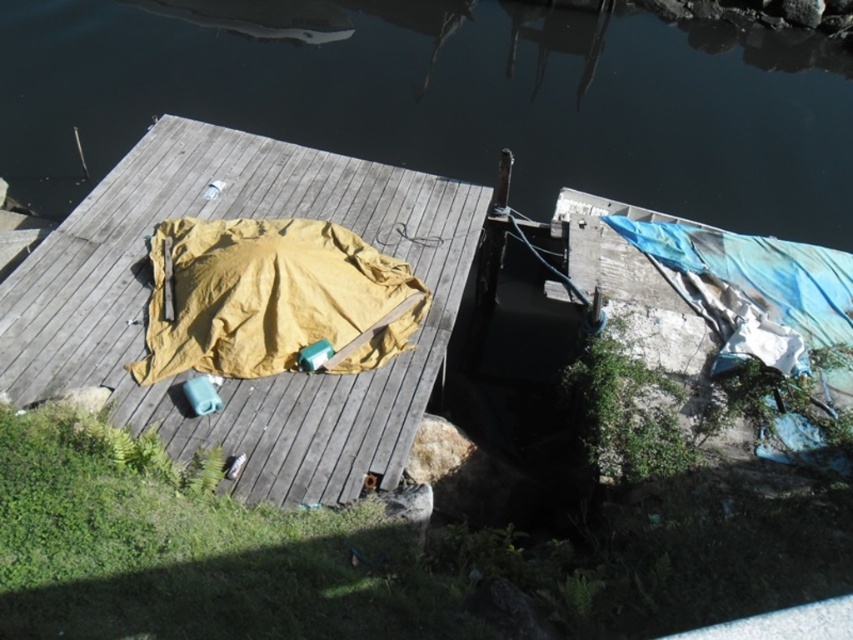
Can you confirm if transparent water at upper center is bigger than yellow fabric blanket at center?

Yes, transparent water at upper center is bigger than yellow fabric blanket at center.

Which is below, transparent water at upper center or yellow fabric blanket at center?

yellow fabric blanket at center is lower down.

In order to click on transparent water at upper center in this screenshot , I will do `click(456, 104)`.

Does matte yellow tarp at center appear over yellow fabric blanket at center?

Incorrect, matte yellow tarp at center is not positioned above yellow fabric blanket at center.

Between matte yellow tarp at center and yellow fabric blanket at center, which one is positioned higher?

yellow fabric blanket at center is above.

Identify the location of matte yellow tarp at center. (234, 378).

The width and height of the screenshot is (853, 640). I want to click on matte yellow tarp at center, so click(234, 378).

Can you confirm if transparent water at upper center is thinner than matte yellow tarp at center?

In fact, transparent water at upper center might be wider than matte yellow tarp at center.

Which is in front, point (321, 109) or point (334, 436)?

Point (334, 436) is more forward.

The image size is (853, 640). What do you see at coordinates (456, 104) in the screenshot?
I see `transparent water at upper center` at bounding box center [456, 104].

At what (x,y) coordinates should I click in order to perform the action: click on transparent water at upper center. Please return your answer as a coordinate pair (x, y). The height and width of the screenshot is (640, 853). Looking at the image, I should click on (456, 104).